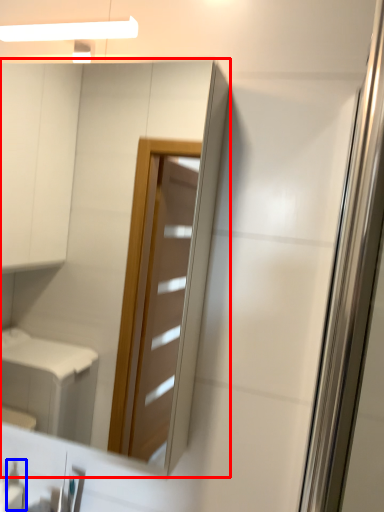
Question: Among these objects, which one is farthest to the camera, mirror (highlighted by a red box) or toiletry (highlighted by a blue box)?

Choices:
 (A) mirror
 (B) toiletry

Answer: (B)